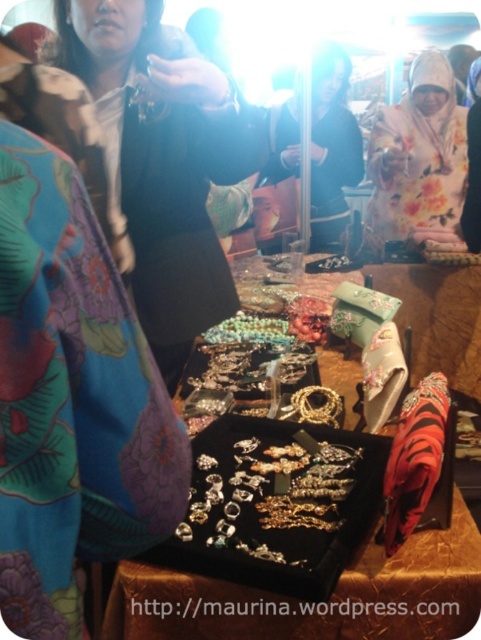
You are a vendor at the market and need to place both the black velvet jewelry at center and the floral silk scarf at center on a small display shelf. Which item should you place first to maximize shelf space efficiency?

You should place the black velvet jewelry at center first because it occupies less space than the floral silk scarf at center, allowing the larger scarf to be arranged around it efficiently.

You are a customer at the market and want to know which item is shorter between the black velvet jewelry at center and the floral silk scarf at center. Can you tell me?

The black velvet jewelry at center is shorter than the floral silk scarf at center.

The scene shows a market with jewelry on a table. There is a point at coordinates (x=164, y=157). What object is located at that point?

The object at point (x=164, y=157) is the matte black jacket at center.